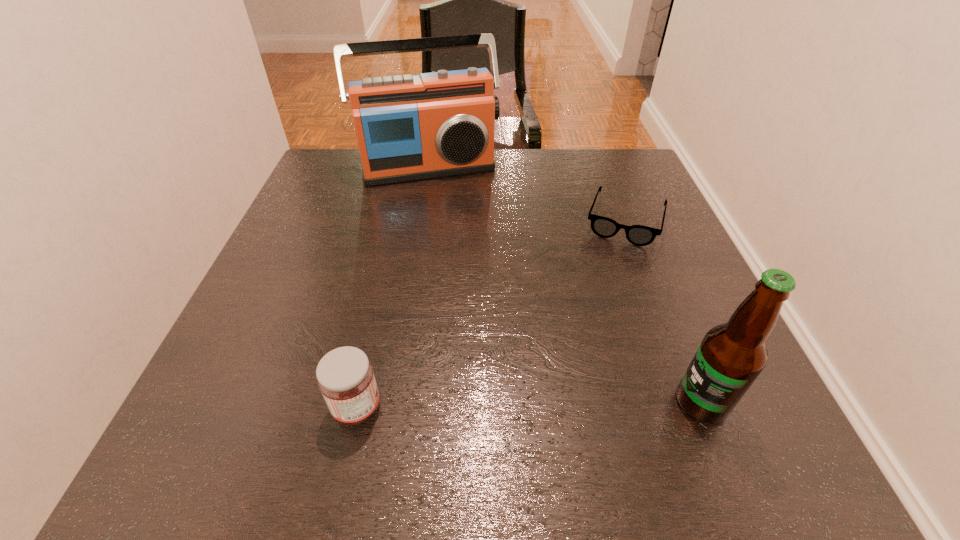
Locate an element on the screen. This screenshot has height=540, width=960. spectacles that is at the right edge is located at coordinates (639, 235).

The image size is (960, 540). What are the coordinates of `object positioned at the far left corner` in the screenshot? It's located at (438, 124).

Locate an element on the screen. This screenshot has height=540, width=960. object that is at the near right corner is located at coordinates (731, 356).

This screenshot has width=960, height=540. Identify the location of vacant space at the far edge. (499, 161).

The height and width of the screenshot is (540, 960). What are the coordinates of `vacant space at the near edge of the desktop` in the screenshot? It's located at (597, 393).

Locate an element on the screen. This screenshot has height=540, width=960. vacant space at the left edge of the desktop is located at coordinates (333, 279).

Locate an element on the screen. free space at the right edge is located at coordinates 695,274.

In the image, there is a desktop. Identify the location of vacant area at the far left corner. coord(346,174).

Where is `vacant region at the near left corner of the desktop`? vacant region at the near left corner of the desktop is located at coordinates (285, 392).

In the image, there is a desktop. Where is `free space at the far right corner`? The width and height of the screenshot is (960, 540). free space at the far right corner is located at coordinates (606, 148).